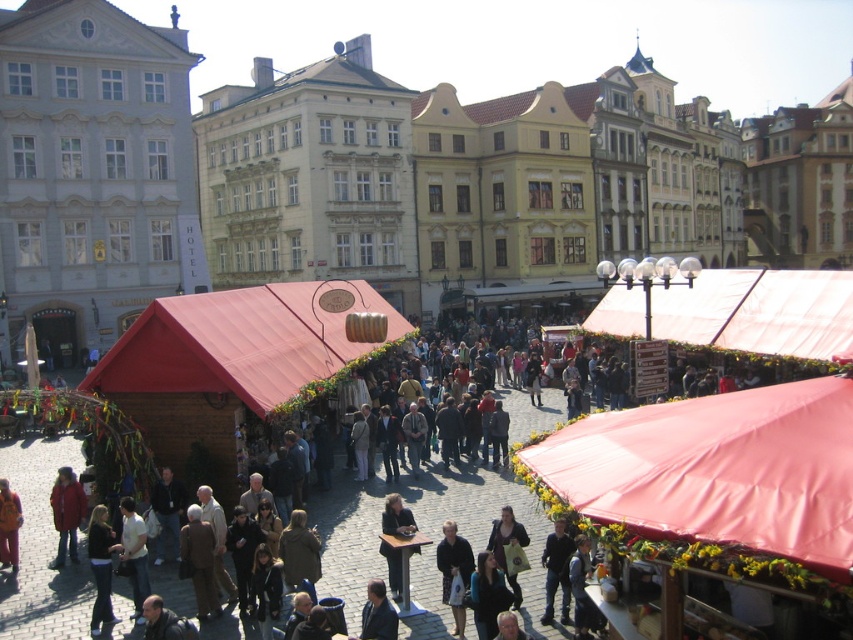
Question: Which point is farther to the camera?

Choices:
 (A) dark blue fabric coat at center
 (B) dark blue jeans at center
 (C) matte red canopy at center right

Answer: (C)

Question: Which point is farther to the camera?

Choices:
 (A) dark blue jeans at center
 (B) dark blue suit at center
 (C) matte red canopy at center right
 (D) leather bag at center

Answer: (C)

Question: Is red fabric canopy at center positioned at the back of light brown leather jacket at lower left?

Choices:
 (A) yes
 (B) no

Answer: (B)

Question: Is dark blue jeans at lower left below leather bag at center?

Choices:
 (A) yes
 (B) no

Answer: (A)

Question: Observing the image, what is the correct spatial positioning of dark blue jeans at center in reference to dark blue suit at center?

Choices:
 (A) below
 (B) above

Answer: (B)

Question: Among these objects, which one is farthest from the camera?

Choices:
 (A) dark blue fabric coat at center
 (B) dark gray fabric jacket at center
 (C) matte red canopy at center right
 (D) dark blue suit at center

Answer: (C)